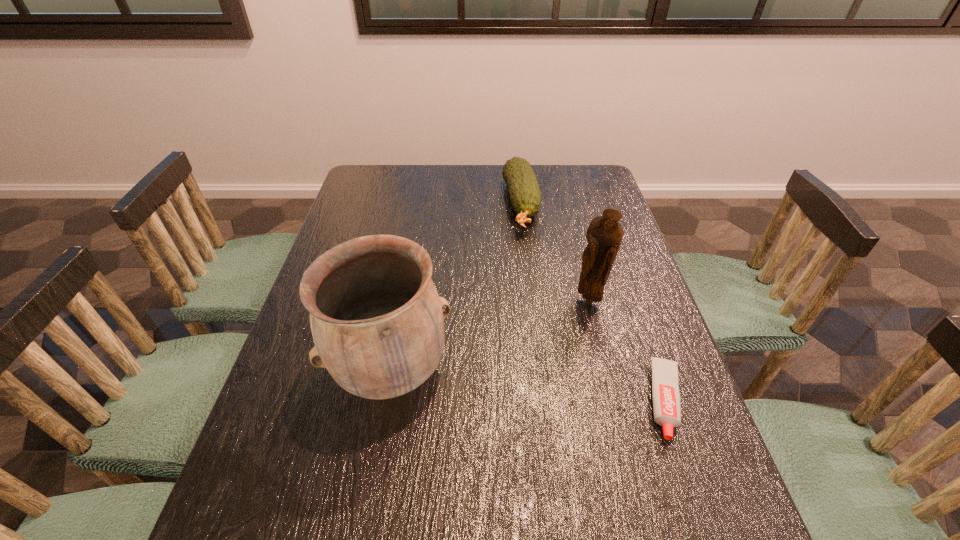
Locate an element on the screen. This screenshot has width=960, height=540. blank space at the near edge is located at coordinates (334, 495).

Where is `blank space at the right edge of the desktop`? Image resolution: width=960 pixels, height=540 pixels. blank space at the right edge of the desktop is located at coordinates (642, 275).

At what (x,y) coordinates should I click in order to perform the action: click on vacant region at the far right corner of the desktop. Please return your answer as a coordinate pair (x, y). The width and height of the screenshot is (960, 540). Looking at the image, I should click on (559, 174).

At what (x,y) coordinates should I click in order to perform the action: click on vacant area between the third tallest object and the urn. Please return your answer as a coordinate pair (x, y). The width and height of the screenshot is (960, 540). Looking at the image, I should click on (456, 288).

Where is `free space between the farthest object and the second object from right to left`? free space between the farthest object and the second object from right to left is located at coordinates (555, 253).

Identify the location of free point between the second shortest object and the rightmost object. The width and height of the screenshot is (960, 540). (593, 302).

Where is `free spot between the shortest object and the cucumber`? Image resolution: width=960 pixels, height=540 pixels. free spot between the shortest object and the cucumber is located at coordinates (593, 302).

Image resolution: width=960 pixels, height=540 pixels. In order to click on empty space between the toothpaste and the urn in this screenshot , I will do `click(529, 386)`.

At what (x,y) coordinates should I click in order to perform the action: click on vacant region between the cucumber and the shortest object. Please return your answer as a coordinate pair (x, y). The height and width of the screenshot is (540, 960). Looking at the image, I should click on tap(593, 302).

Where is `vacant area that lies between the shortest object and the leftmost object`? The height and width of the screenshot is (540, 960). vacant area that lies between the shortest object and the leftmost object is located at coordinates point(529,386).